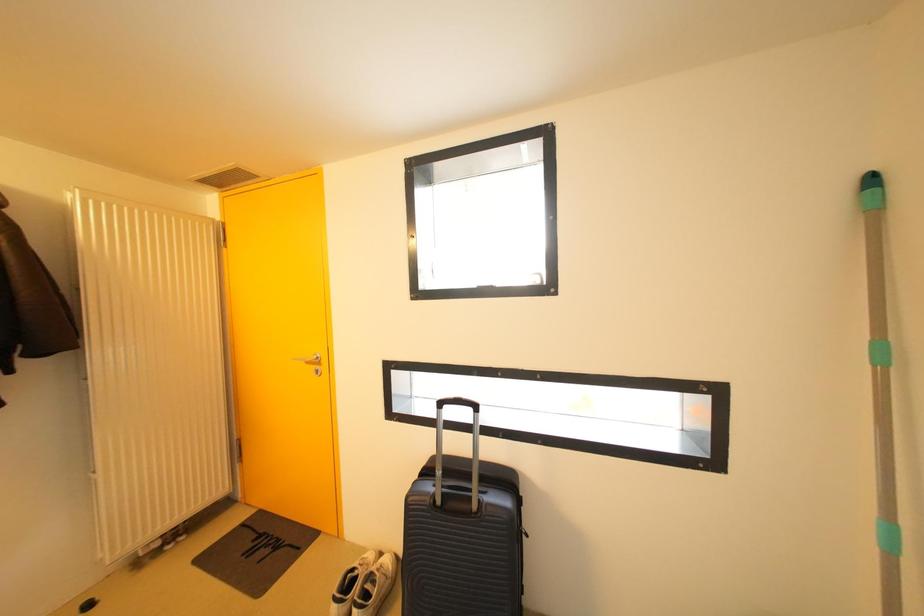
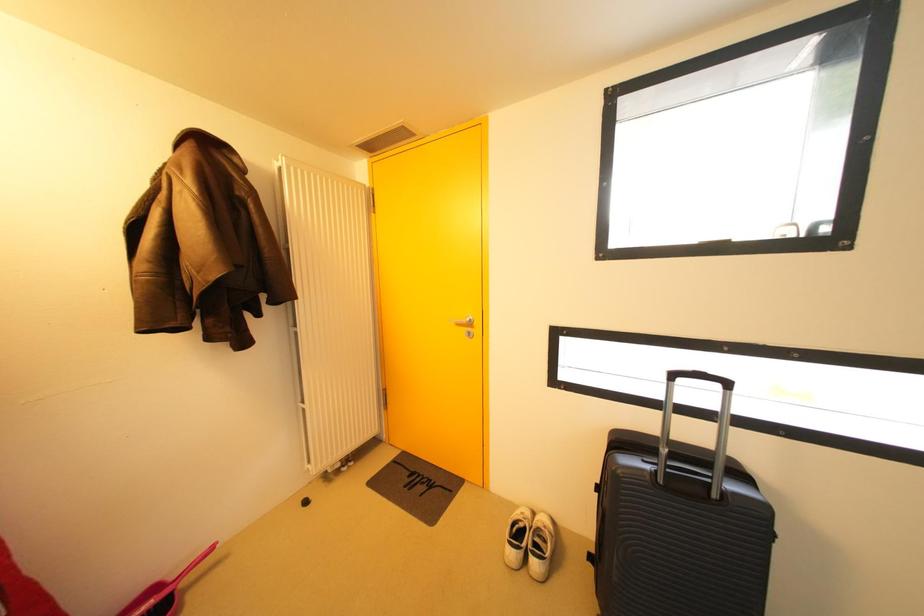
Question: Based on the continuous images, in which direction is the camera rotating? Reply with the corresponding letter.

Choices:
 (A) Left
 (B) Right
 (C) Up
 (D) Down

Answer: (A)